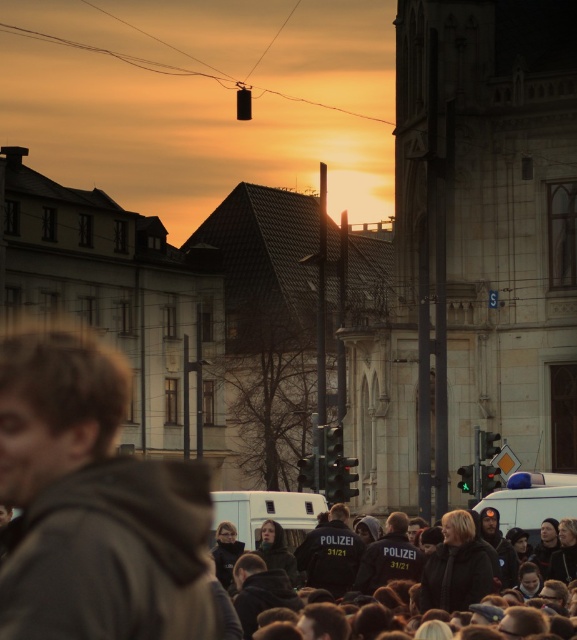
Question: Is white matte police van at center above white plastic police van at lower right?

Choices:
 (A) yes
 (B) no

Answer: (B)

Question: Considering the relative positions of white matte police van at center and white plastic police van at lower right in the image provided, where is white matte police van at center located with respect to white plastic police van at lower right?

Choices:
 (A) below
 (B) above

Answer: (A)

Question: Based on their relative distances, which object is nearer to the dark brown hoodie at center?

Choices:
 (A) white plastic police van at lower right
 (B) white matte police van at center
 (C) black matte uniform at center

Answer: (C)

Question: Which point is farther to the camera?

Choices:
 (A) (188, 540)
 (B) (530, 524)

Answer: (B)

Question: Can you confirm if dark brown hoodie at center is positioned above black matte uniform at center?

Choices:
 (A) no
 (B) yes

Answer: (B)

Question: Which object appears closest to the camera in this image?

Choices:
 (A) dark brown hoodie at center
 (B) white plastic police van at lower right
 (C) black matte uniform at center
 (D) white matte police van at center

Answer: (A)